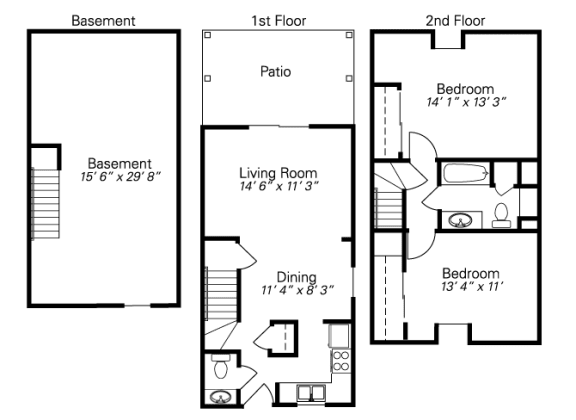
Where is `doors`? doors is located at coordinates click(x=252, y=262), click(x=256, y=373), click(x=264, y=335), click(x=263, y=385), click(x=419, y=255), click(x=435, y=148), click(x=426, y=205), click(x=291, y=128).